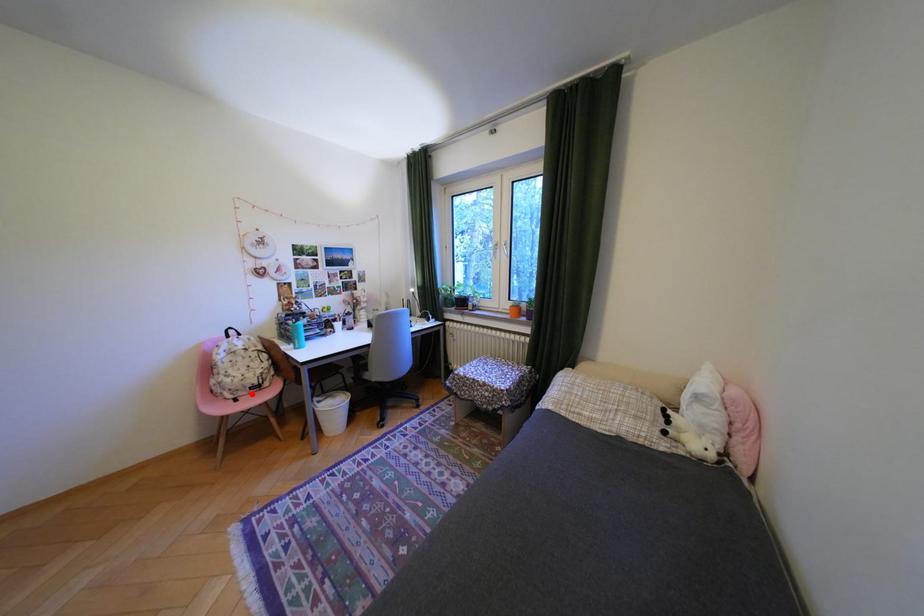
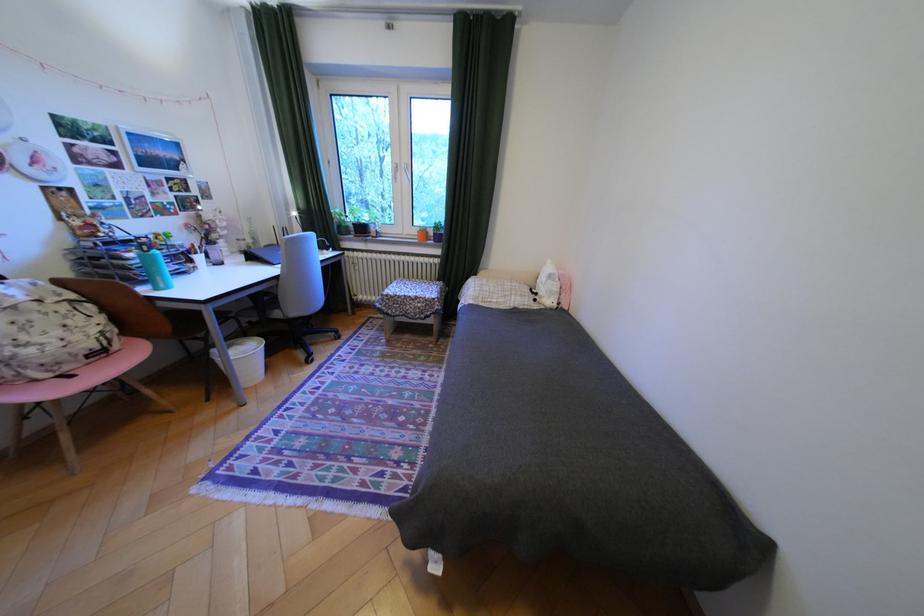
Find the pixel in the second image that matches the highlighted location in the first image.

(79, 368)